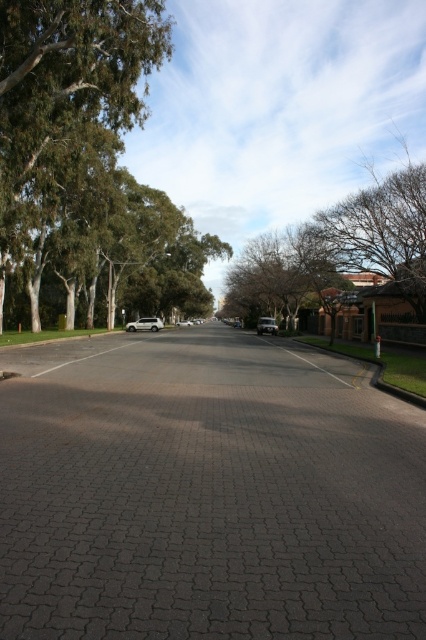
Can you confirm if white asphalt road at center is positioned below silver metallic suv at center?

Correct, white asphalt road at center is located below silver metallic suv at center.

At what (x,y) coordinates should I click in order to perform the action: click on white asphalt road at center. Please return your answer as a coordinate pair (x, y). Looking at the image, I should click on (81, 358).

The image size is (426, 640). I want to click on white asphalt road at center, so pyautogui.click(x=81, y=358).

Based on the photo, does brown leafy tree at upper right have a smaller size compared to white matte car at center?

No.

Is brown leafy tree at upper right shorter than white matte car at center?

No.

Locate an element on the screen. This screenshot has height=640, width=426. brown leafy tree at upper right is located at coordinates (382, 230).

Is white asphalt road at center to the right of silver metallic car at center from the viewer's perspective?

Incorrect, white asphalt road at center is not on the right side of silver metallic car at center.

Is white asphalt road at center bigger than silver metallic car at center?

No, white asphalt road at center is not bigger than silver metallic car at center.

Which is in front, point (98, 355) or point (267, 326)?

Positioned in front is point (98, 355).

Locate an element on the screen. white asphalt road at center is located at coordinates (81, 358).